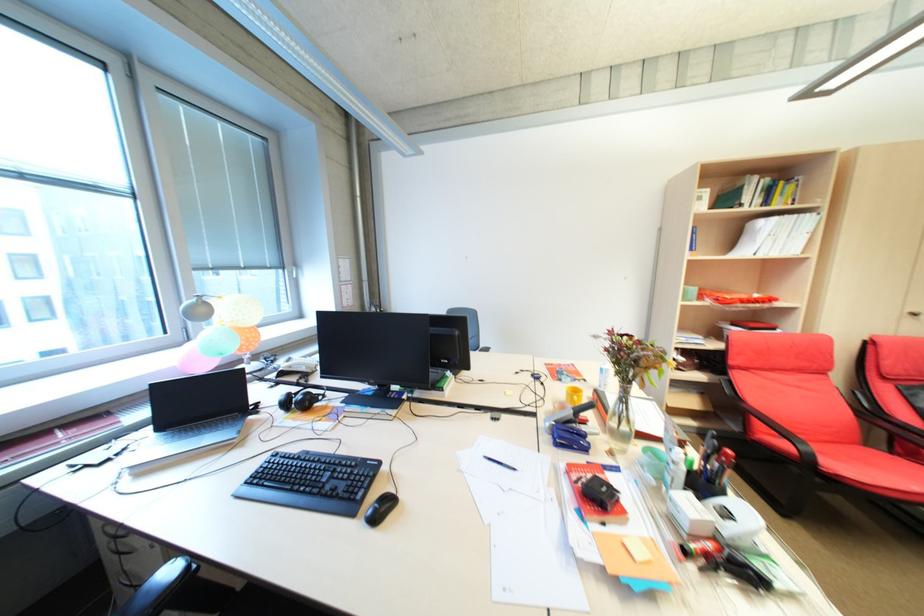
Find where to sit the red chair sitting surface. Please return your answer as a coordinate pair (x, y).

(874, 464)